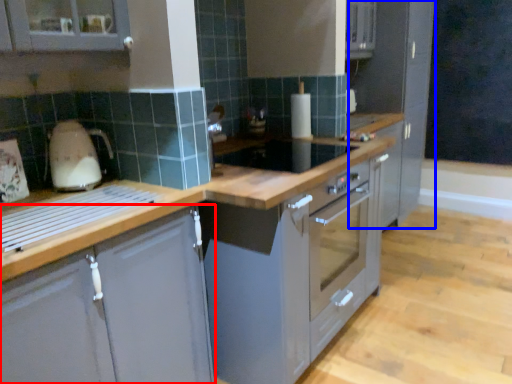
Question: Which point is further to the camera, cabinetry (highlighted by a red box) or cabinetry (highlighted by a blue box)?

Choices:
 (A) cabinetry
 (B) cabinetry

Answer: (B)